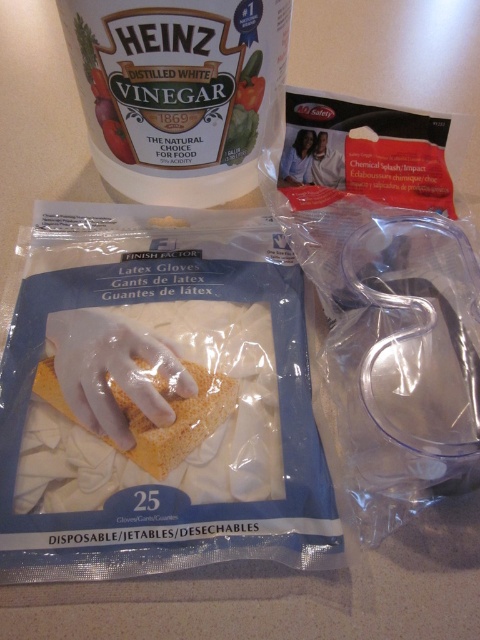
Who is positioned more to the left, white plastic container at upper left or yellow sponge at center?

yellow sponge at center is more to the left.

Is point (121, 99) farther from viewer compared to point (181, 406)?

That is True.

Image resolution: width=480 pixels, height=640 pixels. In order to click on white plastic container at upper left in this screenshot , I will do `click(177, 92)`.